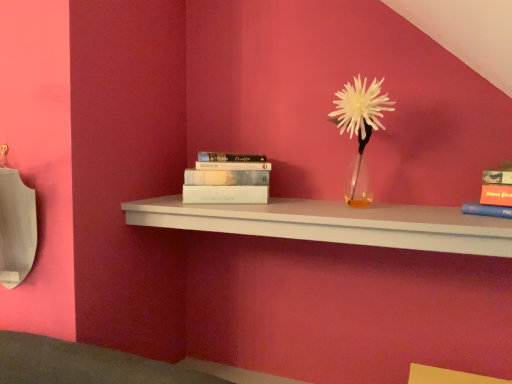
Question: In the image, is white matte flower at center positioned in front of or behind white matte shelf at center?

Choices:
 (A) front
 (B) behind

Answer: (B)

Question: Is white matte flower at center wider or thinner than white matte shelf at center?

Choices:
 (A) thin
 (B) wide

Answer: (A)

Question: Which object is the farthest from the white matte shelf at center?

Choices:
 (A) white matte book at center, which ranks as the 2th book in right-to-left order
 (B) white matte flower at center
 (C) matte orange book at upper right, acting as the 1th book starting from the right

Answer: (C)

Question: Based on their relative distances, which object is farther from the white matte shelf at center?

Choices:
 (A) white matte flower at center
 (B) white matte book at center, which ranks as the 2th book in right-to-left order
 (C) matte orange book at upper right, the first book from the front

Answer: (C)